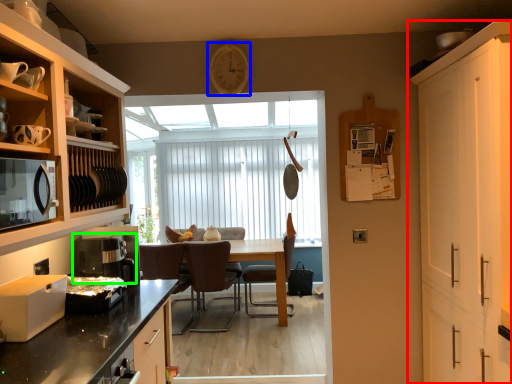
Question: Which object is positioned farthest from cabinetry (highlighted by a red box)? Select from clock (highlighted by a blue box) and coffee machine (highlighted by a green box).

Choices:
 (A) clock
 (B) coffee machine

Answer: (B)